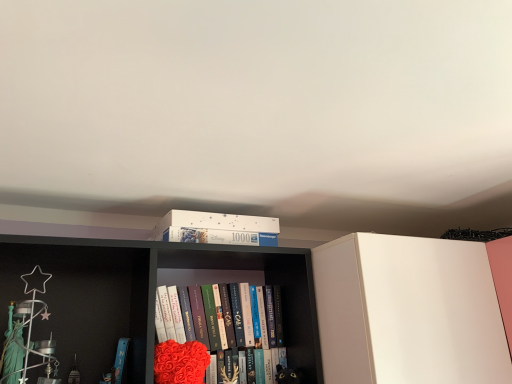
The width and height of the screenshot is (512, 384). I want to click on vacant space situated on the left part of white cardboard puzzle box at upper center, so click(154, 253).